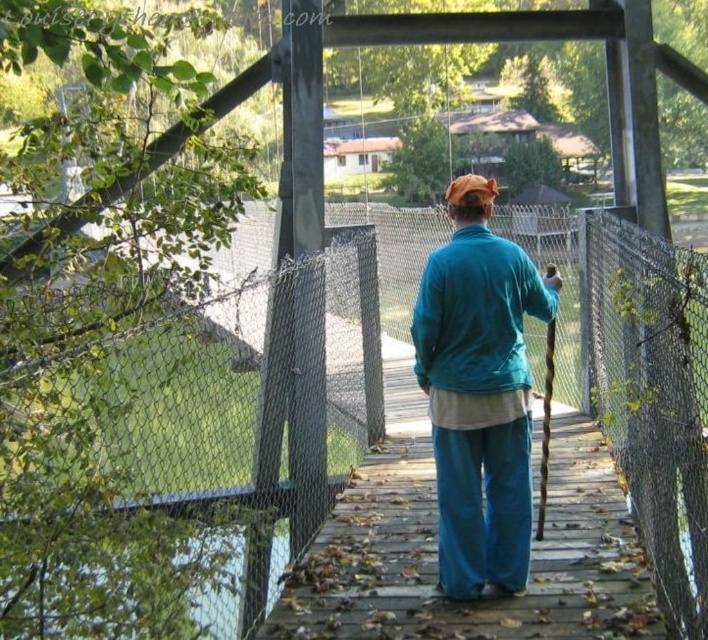
Question: Which point is farther to the camera?

Choices:
 (A) teal velvety jacket at center
 (B) clear water at lower left

Answer: (A)

Question: In this image, where is teal velvety jacket at center located relative to clear water at lower left?

Choices:
 (A) below
 (B) above

Answer: (B)

Question: Can you confirm if teal velvety jacket at center is thinner than clear water at lower left?

Choices:
 (A) yes
 (B) no

Answer: (B)

Question: In this image, where is teal velvety jacket at center located relative to clear water at lower left?

Choices:
 (A) right
 (B) left

Answer: (A)

Question: Which object is closer to the camera taking this photo?

Choices:
 (A) clear water at lower left
 (B) teal velvety jacket at center

Answer: (A)